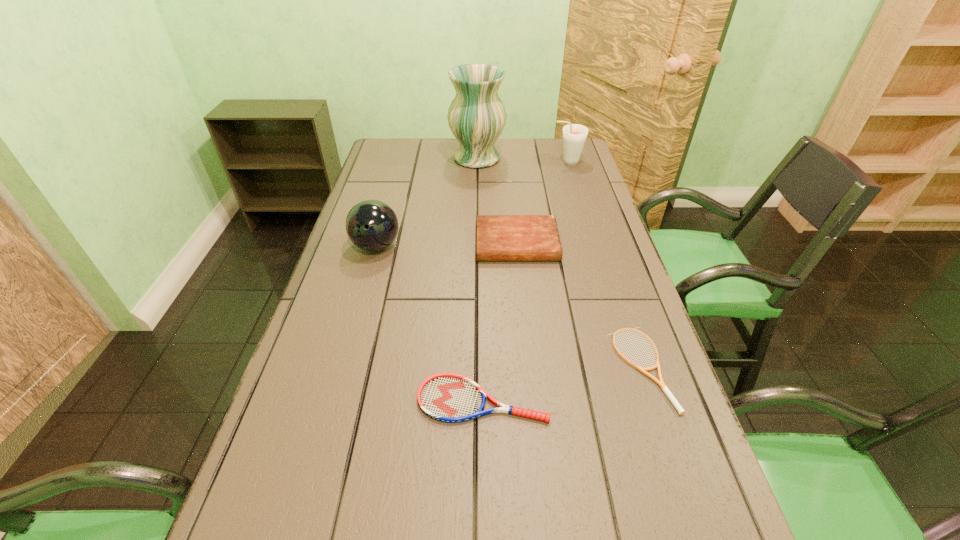
I want to click on tennis racket present at the right edge, so click(x=661, y=383).

Identify the location of object present at the far right corner. The image size is (960, 540). (574, 135).

Locate an element on the screen. The height and width of the screenshot is (540, 960). blank space at the far edge is located at coordinates tap(540, 153).

The width and height of the screenshot is (960, 540). I want to click on blank space at the left edge of the desktop, so 357,358.

In the image, there is a desktop. Where is `vacant space at the right edge`? vacant space at the right edge is located at coordinates [657, 340].

Identify the location of vacant space at the far right corner of the desktop. The image size is (960, 540). (544, 155).

Find the location of a particular element. vacant space that's between the root beer and the leftmost object is located at coordinates (471, 204).

Identify the location of free space that is in between the root beer and the bowling ball. The width and height of the screenshot is (960, 540). (471, 204).

Where is `vacant area that lies between the shortest object and the root beer`? This screenshot has width=960, height=540. vacant area that lies between the shortest object and the root beer is located at coordinates (604, 265).

Identify the location of free space between the right tennis racket and the Bible. This screenshot has height=540, width=960. (579, 306).